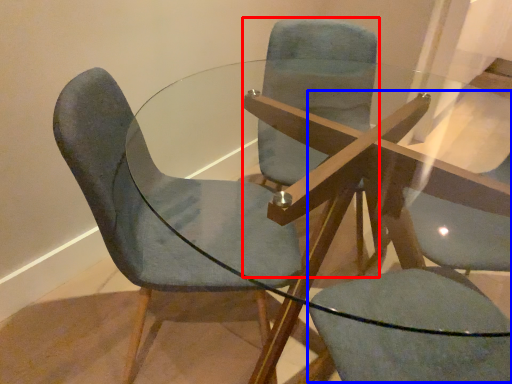
Question: Which of the following is the closest to the observer, chair (highlighted by a red box) or swivel chair (highlighted by a blue box)?

Choices:
 (A) chair
 (B) swivel chair

Answer: (B)